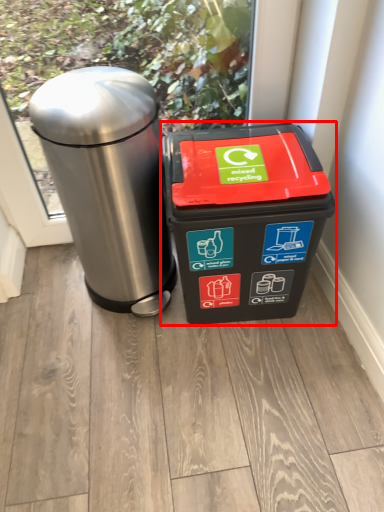
Question: From the image's perspective, where is waste container (annotated by the red box) located in relation to waste container in the image?

Choices:
 (A) below
 (B) above

Answer: (A)